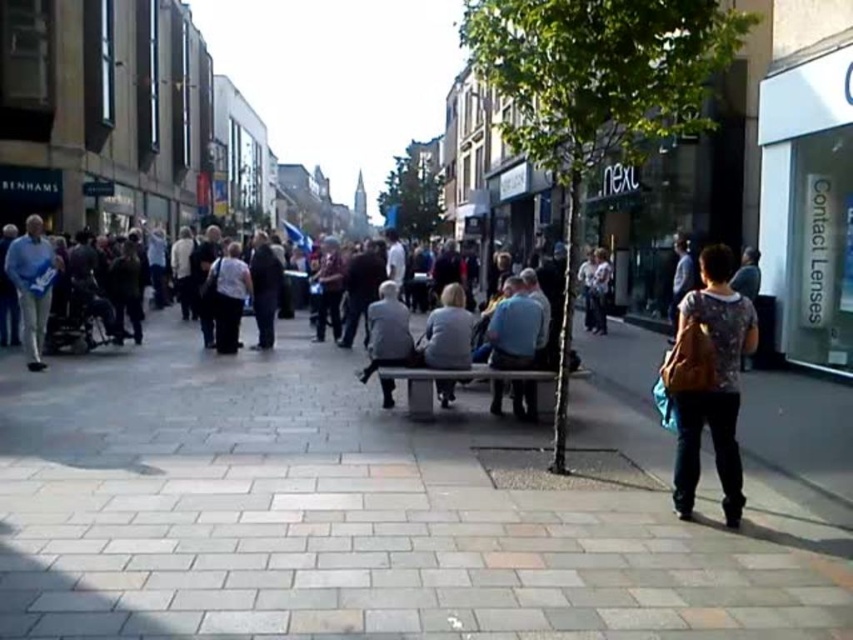
Between patterned fabric shirt at right and blue fabric jacket at center, which one has more height?

With more height is patterned fabric shirt at right.

Which is in front, point (686, 369) or point (511, 314)?

Point (686, 369) is more forward.

Is point (730, 428) closer to viewer compared to point (534, 321)?

Yes, it is.

The image size is (853, 640). In order to click on patterned fabric shirt at right in this screenshot , I will do [x=709, y=380].

Between light gray fabric jacket at center and gray fabric jacket at center, which one has less height?

With less height is light gray fabric jacket at center.

Looking at this image, who is higher up, light gray fabric jacket at center or gray fabric jacket at center?

light gray fabric jacket at center is above.

Is point (456, 292) positioned after point (404, 356)?

Yes.

Locate an element on the screen. This screenshot has height=640, width=853. light gray fabric jacket at center is located at coordinates (447, 332).

Is light blue fabric bag at left bigger than light gray fabric jacket at center?

Yes, light blue fabric bag at left is bigger than light gray fabric jacket at center.

Can you confirm if light blue fabric bag at left is positioned to the right of light gray fabric jacket at center?

In fact, light blue fabric bag at left is to the left of light gray fabric jacket at center.

Between point (26, 232) and point (444, 307), which one is positioned behind?

Point (26, 232)

Image resolution: width=853 pixels, height=640 pixels. In order to click on light blue fabric bag at left in this screenshot , I will do `click(32, 284)`.